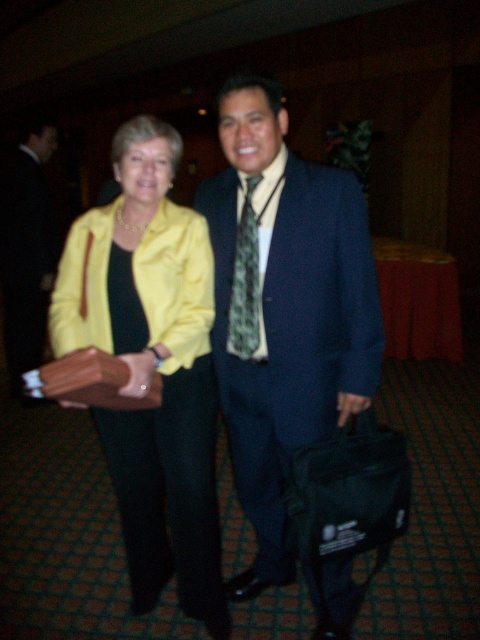
Question: From the image, what is the correct spatial relationship of matte blue suit at center in relation to matte black suit at center?

Choices:
 (A) left
 (B) right

Answer: (B)

Question: Is matte blue suit at center above satin yellow jacket at center?

Choices:
 (A) no
 (B) yes

Answer: (B)

Question: Based on their relative distances, which object is farther from the matte blue suit at center?

Choices:
 (A) matte black suit at center
 (B) satin yellow jacket at center

Answer: (A)

Question: Which object appears farthest from the camera in this image?

Choices:
 (A) matte black suit at center
 (B) satin yellow jacket at center
 (C) green patterned tie at center

Answer: (A)

Question: Among these points, which one is nearest to the camera?

Choices:
 (A) (241, 317)
 (B) (236, 348)
 (C) (8, 152)
 (D) (184, 531)

Answer: (A)

Question: Does satin yellow jacket at center have a larger size compared to matte black suit at center?

Choices:
 (A) no
 (B) yes

Answer: (B)